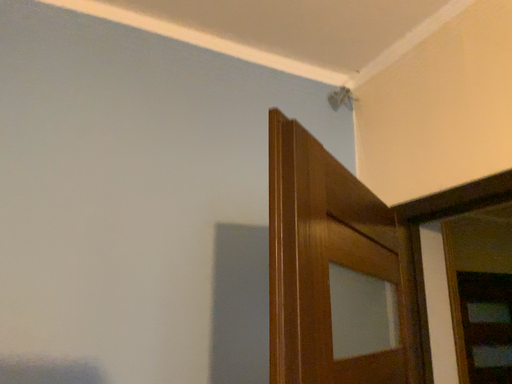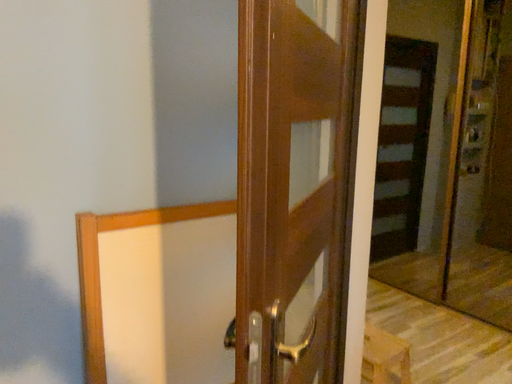
Question: Which way did the camera rotate in the video?

Choices:
 (A) rotated downward
 (B) rotated upward

Answer: (A)